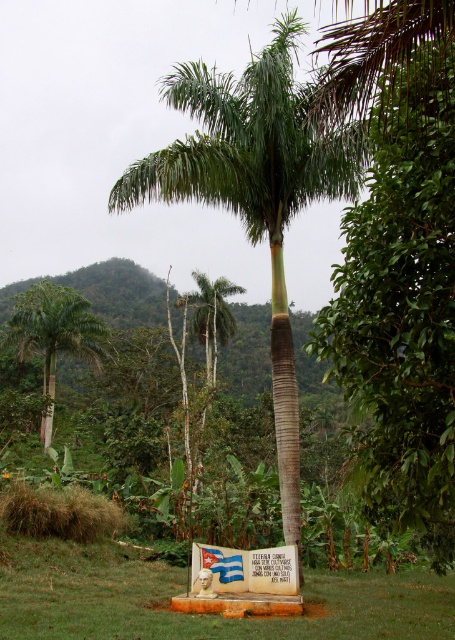
You are standing in the tropical landscape and want to know the distance between the green leafy tree at center and the green leafy palm tree at left. Can you estimate how far apart they are?

The green leafy tree at center is 25.91 meters away from the green leafy palm tree at left.

You are standing in the tropical landscape and want to take a photo of the green leafy palm tree at center and the green grass at center. Which object will appear closer to the camera in your photo?

The green leafy palm tree at center will appear closer to the camera because it is positioned in front of the green grass at center.

You are a botanist studying the tropical plants in the image. You need to identify which of the two trees, the green leafy tree at center or the green leafy palm tree at left, is taller based on their sizes. Which one is taller?

The green leafy tree at center has a larger size compared to the green leafy palm tree at left, so it is taller.